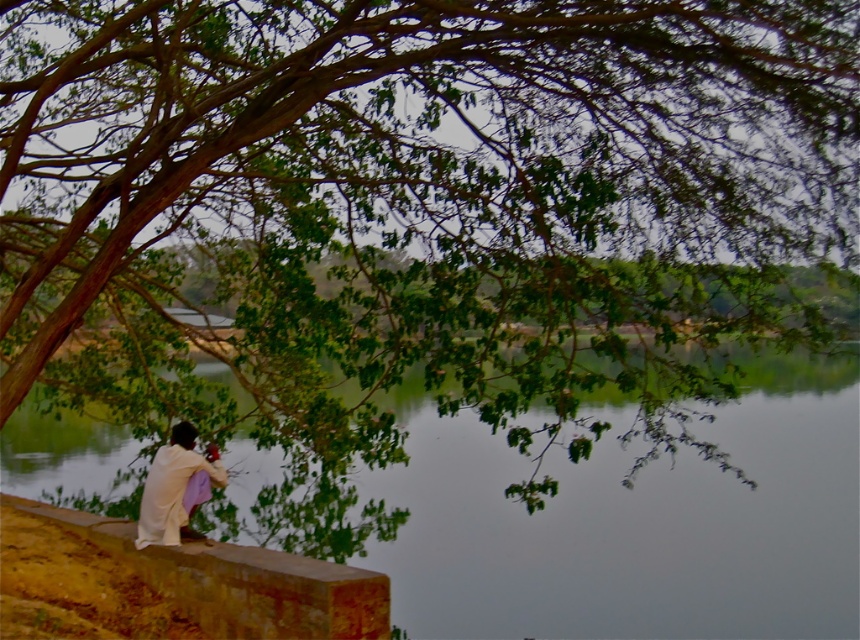
Question: Which of these objects is positioned closest to the smooth stone ledge at lower left?

Choices:
 (A) white cotton cloth at lower left
 (B) green smooth water at center

Answer: (A)

Question: Observing the image, what is the correct spatial positioning of green smooth water at center in reference to white cotton cloth at lower left?

Choices:
 (A) left
 (B) right

Answer: (B)

Question: Which of the following is the closest to the observer?

Choices:
 (A) smooth stone ledge at lower left
 (B) green smooth water at center

Answer: (A)

Question: Where is smooth stone ledge at lower left located in relation to white cotton cloth at lower left in the image?

Choices:
 (A) below
 (B) above

Answer: (A)

Question: Estimate the real-world distances between objects in this image. Which object is closer to the white cotton cloth at lower left?

Choices:
 (A) smooth stone ledge at lower left
 (B) green smooth water at center

Answer: (A)

Question: Is green smooth water at center below white cotton cloth at lower left?

Choices:
 (A) yes
 (B) no

Answer: (A)